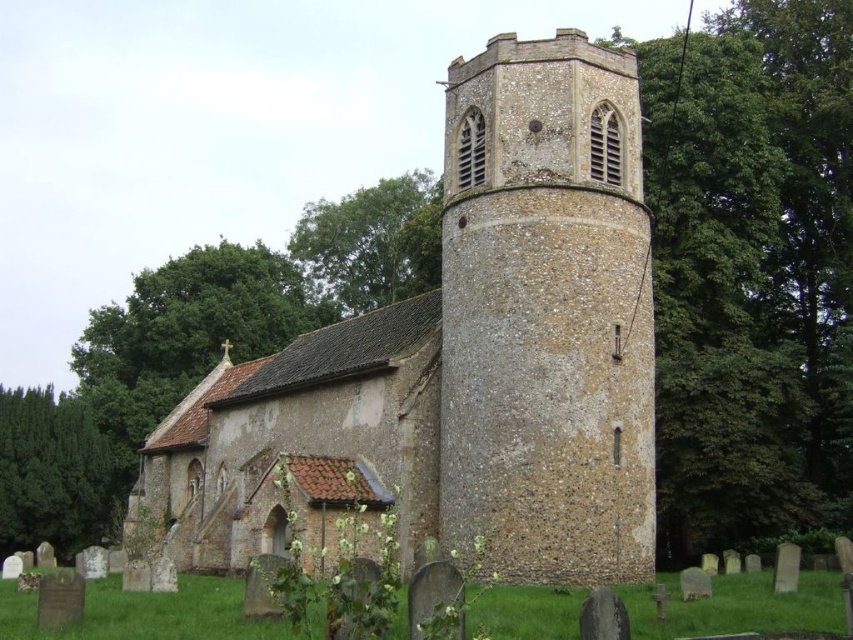
Who is more distant from viewer, (583, 230) or (525, 390)?

The point (583, 230) is behind.

Which is above, brown stone church at center or brown stone tower at center?

brown stone tower at center

Where is `brown stone church at center`? The height and width of the screenshot is (640, 853). brown stone church at center is located at coordinates (462, 356).